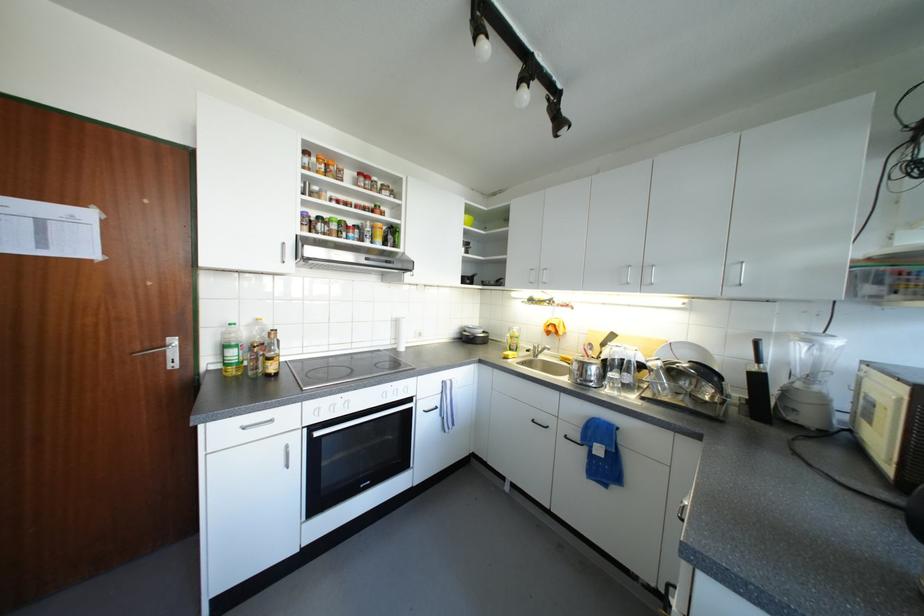
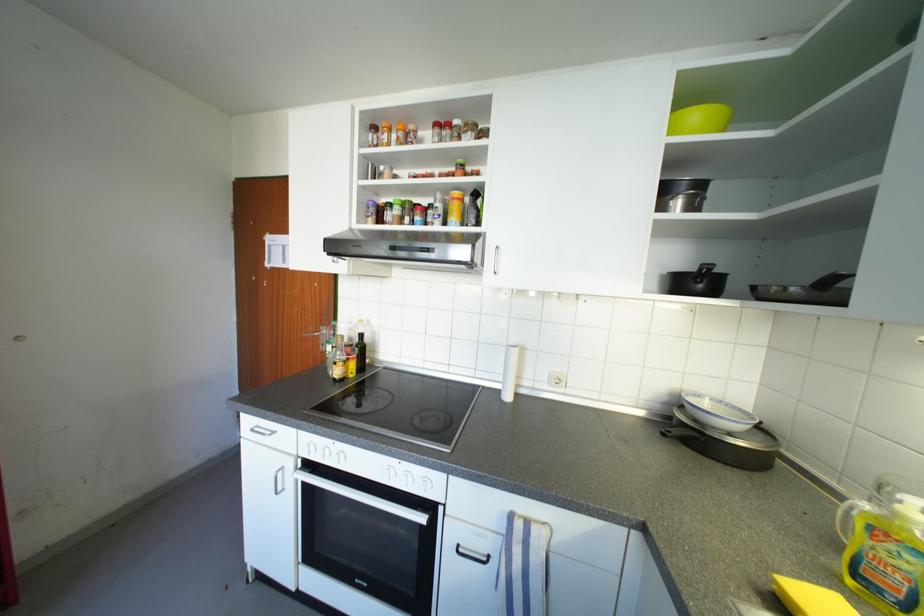
Locate, in the second image, the point that corresponds to point (385, 228) in the first image.

(463, 197)